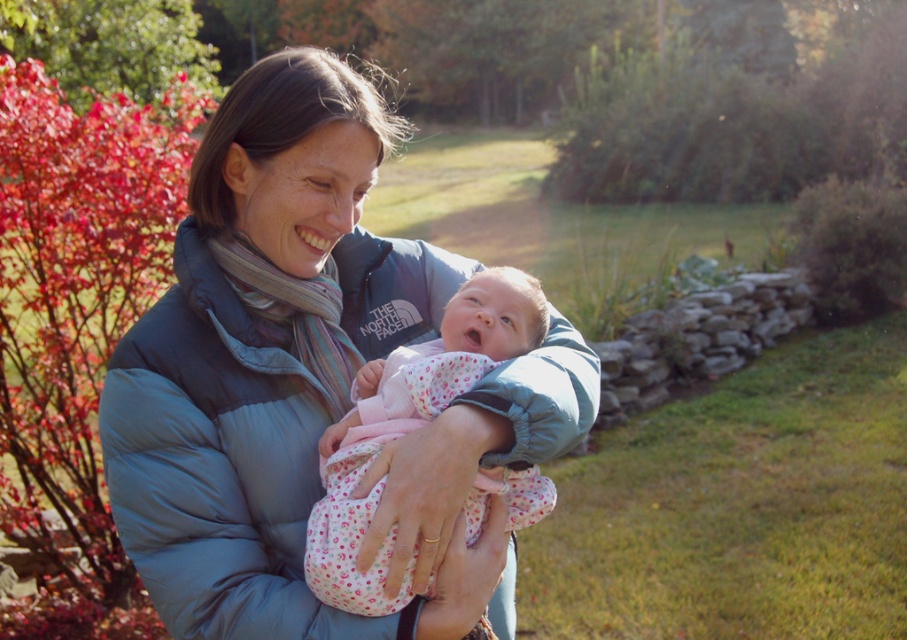
Who is more distant from viewer, (172, 324) or (456, 326)?

Point (456, 326)

Does point (246, 604) lie behind point (350, 490)?

That is True.

At what (x,y) coordinates should I click in order to perform the action: click on matte blue down jacket at center. Please return your answer as a coordinate pair (x, y). Image resolution: width=907 pixels, height=640 pixels. Looking at the image, I should click on (213, 468).